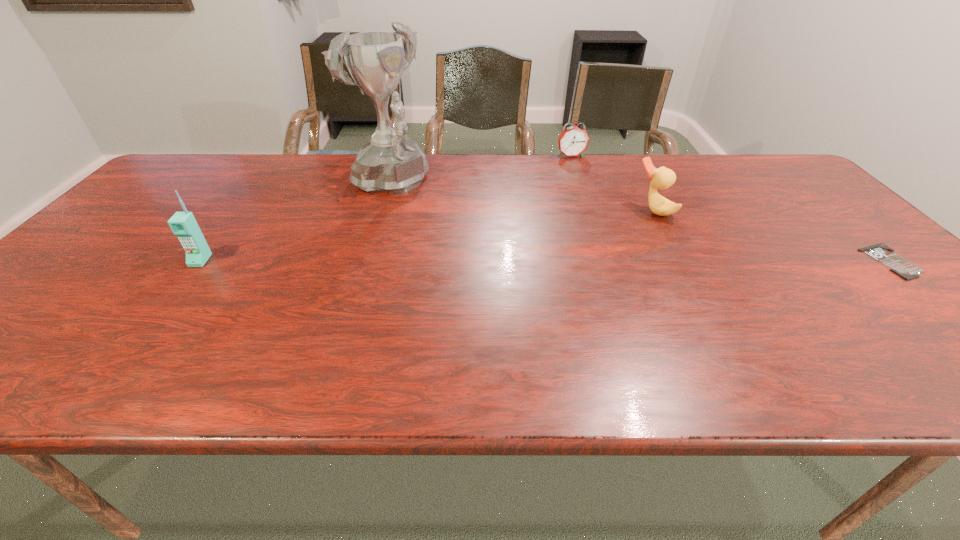
Find the location of a particular element. This screenshot has width=960, height=540. empty space that is in between the cellular telephone and the rightmost object is located at coordinates (546, 261).

Where is `vacant area between the fourth object from right to left and the rightmost object`? vacant area between the fourth object from right to left and the rightmost object is located at coordinates (640, 222).

At what (x,y) coordinates should I click in order to perform the action: click on vacant space that is in between the second tallest object and the shortest object. Please return your answer as a coordinate pair (x, y). This screenshot has width=960, height=540. Looking at the image, I should click on coord(546,261).

Find the location of `free space between the identity card and the fourth object from left to right`. free space between the identity card and the fourth object from left to right is located at coordinates (773, 236).

The width and height of the screenshot is (960, 540). I want to click on vacant region between the identity card and the tallest object, so click(640, 222).

The width and height of the screenshot is (960, 540). In order to click on free space that is in between the leftmost object and the rightmost object in this screenshot , I will do `click(546, 261)`.

Where is `vacant area between the identity card and the duck`? vacant area between the identity card and the duck is located at coordinates (773, 236).

At what (x,y) coordinates should I click in order to perform the action: click on the closest object to the identity card. Please return your answer as a coordinate pair (x, y). Looking at the image, I should click on (662, 178).

Point out which object is positioned as the second nearest to the identity card. Please provide its 2D coordinates. Your answer should be formatted as a tuple, i.e. [(x, y)], where the tuple contains the x and y coordinates of a point satisfying the conditions above.

[(573, 141)]

Where is `free space that satisfies the following two spatial constraints: 1. on the keypad of the rightmost object; 2. on the right side of the leftmost object`? free space that satisfies the following two spatial constraints: 1. on the keypad of the rightmost object; 2. on the right side of the leftmost object is located at coordinates (200, 261).